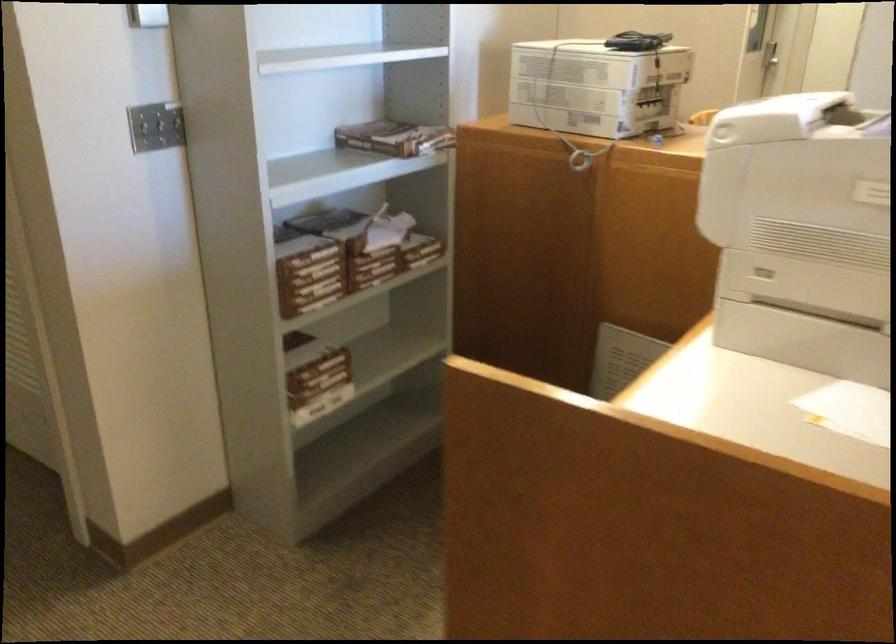
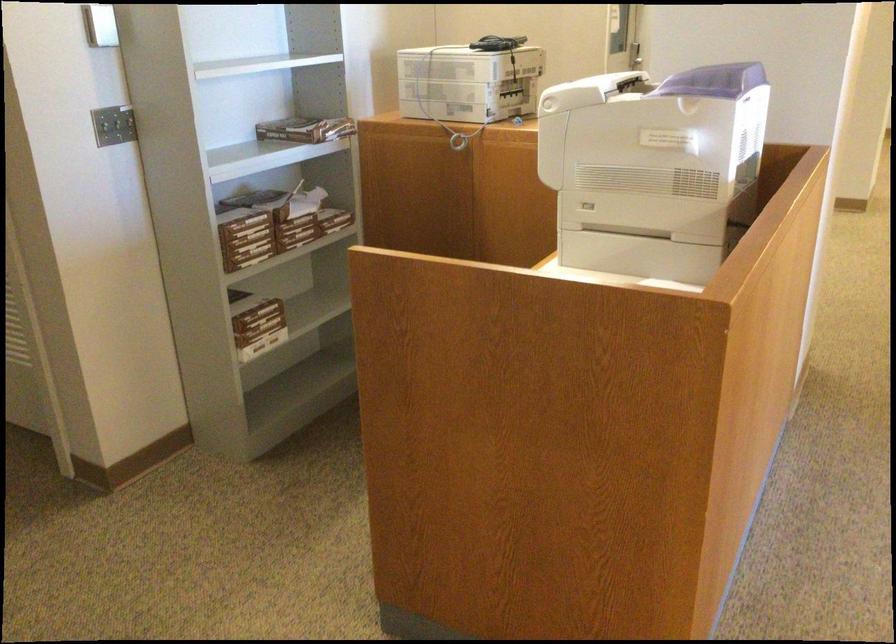
Question: I am providing you with two images of the same scene from different viewpoints. After the viewpoint changes to image2, which objects are now occluded?

Choices:
 (A) printer paper tray
 (B) black handheld device
 (C) printer scanner lid
 (D) none of these

Answer: (D)